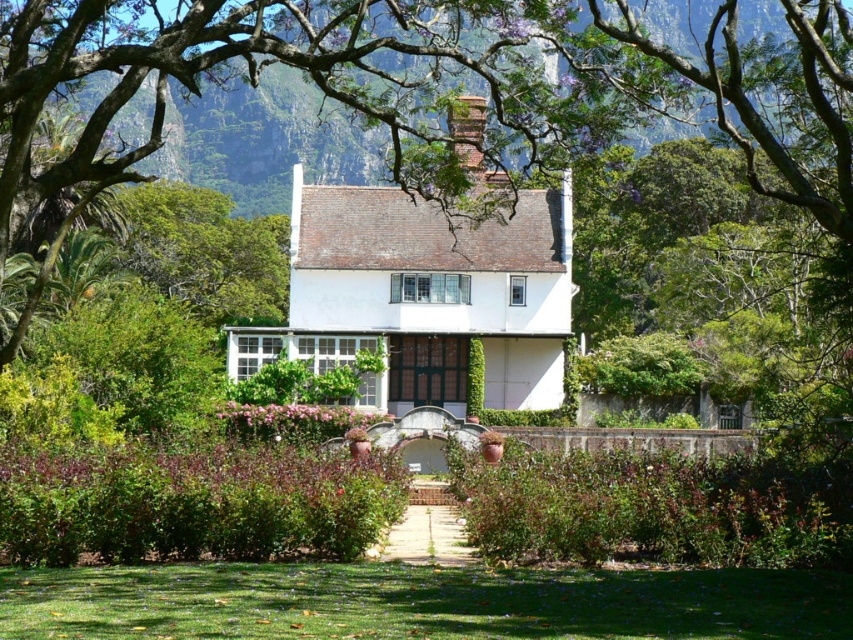
Is green leafy tree at upper center above brick chimney at center?

Yes.

Who is higher up, green leafy tree at upper center or brick chimney at center?

green leafy tree at upper center

Between point (480, 38) and point (469, 132), which one is positioned behind?

Positioned behind is point (480, 38).

You are a GUI agent. You are given a task and a screenshot of the screen. Output one action in this format:
    pyautogui.click(x=<x>, y=<y>)
    Task: Click on the green leafy tree at upper center
    The width and height of the screenshot is (853, 640).
    Given the screenshot: What is the action you would take?
    pyautogui.click(x=438, y=88)

Is green grass at lower center further to the viewer compared to brick chimney at center?

No, green grass at lower center is in front of brick chimney at center.

Does green grass at lower center come in front of brick chimney at center?

Yes.

Between point (312, 616) and point (459, 128), which one is positioned in front?

Point (312, 616) is in front.

Find the location of a particular element. green grass at lower center is located at coordinates (419, 602).

Is green leafy tree at upper center positioned at the back of green grass at lower center?

That is True.

Can you confirm if green leafy tree at upper center is shorter than green grass at lower center?

No.

Does point (196, 80) lie in front of point (134, 586)?

No, (196, 80) is further to viewer.

The image size is (853, 640). Identify the location of green leafy tree at upper center. (438, 88).